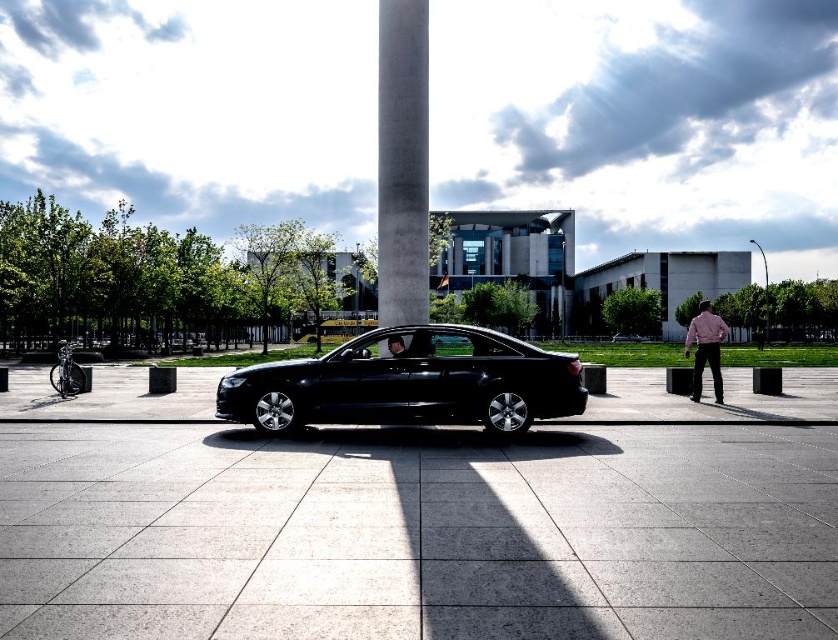
Question: Does black metallic car at center appear on the right side of pink shirt at right?

Choices:
 (A) yes
 (B) no

Answer: (B)

Question: Estimate the real-world distances between objects in this image. Which object is farther from the shiny black sedan at center?

Choices:
 (A) matte black car at center
 (B) black metallic car at center
 (C) concrete column at center
 (D) pink shirt at right

Answer: (A)

Question: Which of these objects is positioned farthest from the black metallic car at center?

Choices:
 (A) pink shirt at right
 (B) shiny black sedan at center
 (C) matte black car at center

Answer: (B)

Question: Is the position of matte black car at center less distant than that of shiny black sedan at center?

Choices:
 (A) yes
 (B) no

Answer: (A)

Question: Does concrete column at center have a lesser width compared to shiny black sedan at center?

Choices:
 (A) yes
 (B) no

Answer: (A)

Question: Which object appears closest to the camera in this image?

Choices:
 (A) concrete column at center
 (B) black metallic car at center
 (C) matte black car at center

Answer: (B)